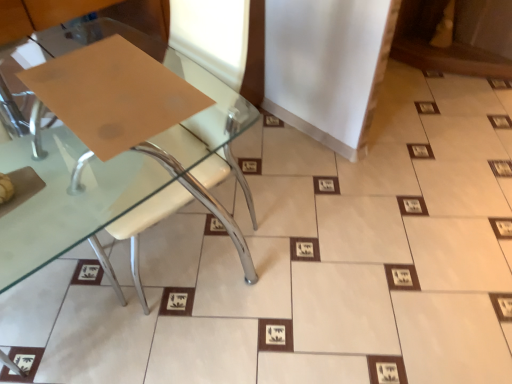
What is the approximate width of matte brown paper at upper left?

matte brown paper at upper left is 18.48 inches in width.

Where is `matte brown paper at upper left`? The image size is (512, 384). matte brown paper at upper left is located at coordinates (113, 95).

Describe the element at coordinates (113, 95) in the screenshot. This screenshot has width=512, height=384. I see `matte brown paper at upper left` at that location.

The width and height of the screenshot is (512, 384). Identify the location of matte brown paper at lower left. (82, 205).

The image size is (512, 384). Describe the element at coordinates (82, 205) in the screenshot. I see `matte brown paper at lower left` at that location.

Find the location of `matte brown paper at upper left`. matte brown paper at upper left is located at coordinates (113, 95).

Which object is positioned more to the right, matte brown paper at lower left or matte brown paper at upper left?

matte brown paper at lower left.

Relative to matte brown paper at upper left, is matte brown paper at lower left in front or behind?

In the image, matte brown paper at lower left appears in front of matte brown paper at upper left.

Is point (7, 247) positioned in front of point (160, 103)?

Yes.

From the image's perspective, is matte brown paper at lower left over matte brown paper at upper left?

Actually, matte brown paper at lower left appears below matte brown paper at upper left in the image.

From a real-world perspective, does matte brown paper at lower left sit lower than matte brown paper at upper left?

Yes, from a real-world perspective, matte brown paper at lower left is beneath matte brown paper at upper left.

From the picture: Between matte brown paper at lower left and matte brown paper at upper left, which one has smaller width?

matte brown paper at upper left is thinner.

Considering the sizes of matte brown paper at lower left and matte brown paper at upper left in the image, is matte brown paper at lower left taller or shorter than matte brown paper at upper left?

Considering their sizes, matte brown paper at lower left has more height than matte brown paper at upper left.

Which of these two, matte brown paper at lower left or matte brown paper at upper left, is bigger?

Bigger between the two is matte brown paper at lower left.

Is matte brown paper at upper left a part of matte brown paper at lower left?

Yes.

From the picture: Is matte brown paper at lower left next to matte brown paper at upper left and touching it?

matte brown paper at lower left is not next to matte brown paper at upper left, and they're not touching.

Could you tell me if matte brown paper at lower left is turned towards matte brown paper at upper left?

A: Yes, matte brown paper at lower left is oriented towards matte brown paper at upper left.

Can you tell me how much matte brown paper at lower left and matte brown paper at upper left differ in facing direction?

The angle between the facing direction of matte brown paper at lower left and the facing direction of matte brown paper at upper left is 90 degrees.

The height and width of the screenshot is (384, 512). I want to click on table below the matte brown paper at upper left (from the image's perspective), so click(82, 205).

Is matte brown paper at upper left at the left side of matte brown paper at lower left?

Correct, you'll find matte brown paper at upper left to the left of matte brown paper at lower left.

Relative to matte brown paper at lower left, is matte brown paper at upper left in front or behind?

matte brown paper at upper left is behind matte brown paper at lower left.

Is point (90, 88) closer or farther from the camera than point (226, 105)?

Point (90, 88) appears to be closer to the viewer than point (226, 105).

From the image's perspective, which one is positioned lower, matte brown paper at upper left or matte brown paper at lower left?

matte brown paper at lower left appears lower in the image.

From a real-world perspective, is matte brown paper at upper left under matte brown paper at lower left?

No, from a real-world perspective, matte brown paper at upper left is not below matte brown paper at lower left.

Does matte brown paper at upper left have a greater width compared to matte brown paper at lower left?

Incorrect, the width of matte brown paper at upper left does not surpass that of matte brown paper at lower left.

Considering the relative sizes of matte brown paper at upper left and matte brown paper at lower left in the image provided, is matte brown paper at upper left shorter than matte brown paper at lower left?

Yes.

Considering the sizes of objects matte brown paper at upper left and matte brown paper at lower left in the image provided, who is bigger, matte brown paper at upper left or matte brown paper at lower left?

With larger size is matte brown paper at lower left.

Would you say matte brown paper at upper left contains matte brown paper at lower left?

No, matte brown paper at lower left is located outside of matte brown paper at upper left.

Is matte brown paper at upper left next to matte brown paper at lower left?

No, matte brown paper at upper left is not touching matte brown paper at lower left.

Is matte brown paper at upper left turned away from matte brown paper at lower left?

Yes, matte brown paper at upper left is positioned with its back facing matte brown paper at lower left.

How many degrees apart are the facing directions of matte brown paper at upper left and matte brown paper at lower left?

The angle between the facing direction of matte brown paper at upper left and the facing direction of matte brown paper at lower left is 90 degrees.

This screenshot has width=512, height=384. What are the coordinates of `cardboard positioned vertically above the matte brown paper at lower left (from a real-world perspective)` in the screenshot? It's located at (113, 95).

Where is `table below the matte brown paper at upper left (from the image's perspective)`? The image size is (512, 384). table below the matte brown paper at upper left (from the image's perspective) is located at coordinates (82, 205).

Where is `table in front of the matte brown paper at upper left`? This screenshot has height=384, width=512. table in front of the matte brown paper at upper left is located at coordinates (82, 205).